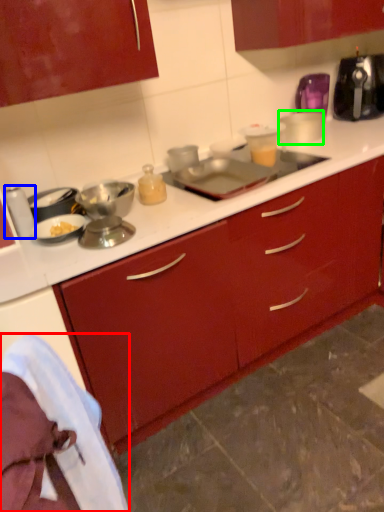
Question: Which is nearer to the material (highlighted by a red box)? appliance (highlighted by a blue box) or appliance (highlighted by a green box).

Choices:
 (A) appliance
 (B) appliance

Answer: (A)